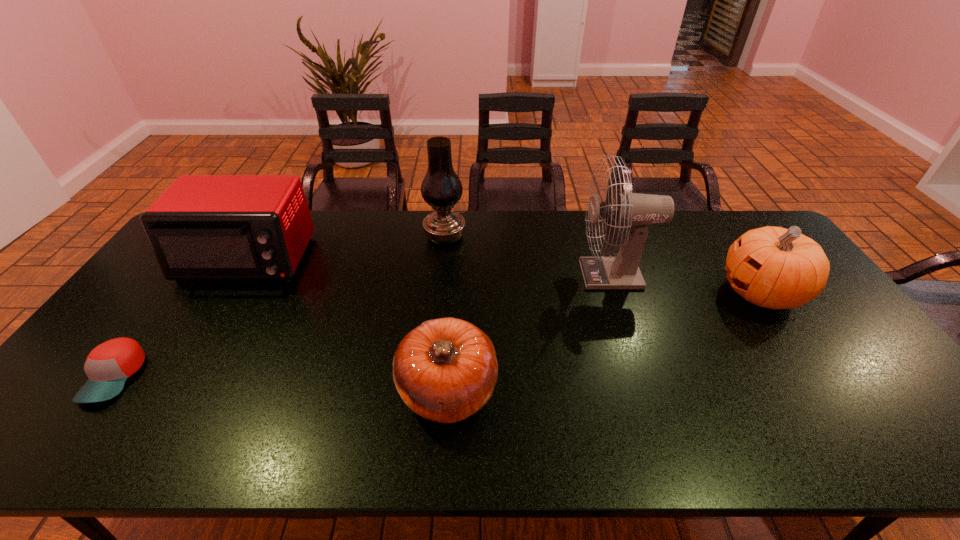
Identify the location of vacant area between the toaster oven and the shortest object. The image size is (960, 540). (180, 318).

Where is `unoccupied area between the oil lamp and the fan`? The width and height of the screenshot is (960, 540). unoccupied area between the oil lamp and the fan is located at coordinates (529, 255).

Find the location of a particular element. This screenshot has width=960, height=540. vacant space in between the toaster oven and the left pumpkin is located at coordinates (347, 325).

You are a GUI agent. You are given a task and a screenshot of the screen. Output one action in this format:
    pyautogui.click(x=<x>, y=<y>)
    Task: Click on the free spot between the toaster oven and the fifth object from left to right
    
    Given the screenshot: What is the action you would take?
    pyautogui.click(x=430, y=267)

Where is `free spot between the right pumpkin and the fifth object from left to right`? The width and height of the screenshot is (960, 540). free spot between the right pumpkin and the fifth object from left to right is located at coordinates (687, 284).

The height and width of the screenshot is (540, 960). Identify the location of free space between the shortest object and the toaster oven. (180, 318).

Where is `vacant area that lies between the toaster oven and the right pumpkin`? The image size is (960, 540). vacant area that lies between the toaster oven and the right pumpkin is located at coordinates (504, 276).

Find the location of a particular element. This screenshot has width=960, height=540. vacant point located between the oil lamp and the left pumpkin is located at coordinates coord(446,313).

Locate which object is the fifth closest to the taller pumpkin. Please provide its 2D coordinates. Your answer should be formatted as a tuple, i.e. [(x, y)], where the tuple contains the x and y coordinates of a point satisfying the conditions above.

[(108, 366)]

Locate which object ranks second in proximity to the shorter pumpkin. Please provide its 2D coordinates. Your answer should be formatted as a tuple, i.e. [(x, y)], where the tuple contains the x and y coordinates of a point satisfying the conditions above.

[(441, 188)]